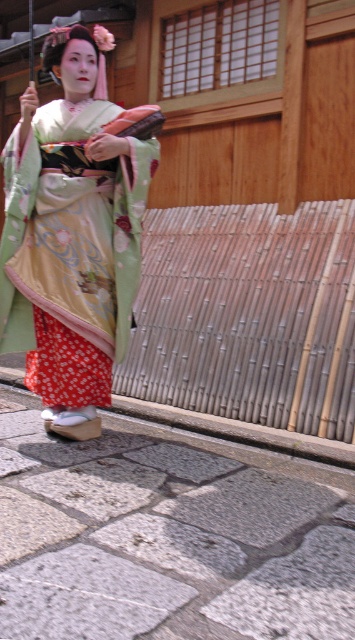
You are standing at the point marked as point (165, 540) in the image. What is the name of the object located exactly at your current position?

The gray stone pavement at lower center is located at point (165, 540).

You are standing on the gray stone pavement at lower center and want to walk towards the silky green kimono at center. Which direction should you move to get closer to the kimono?

You should move forward because the gray stone pavement at lower center is closer to the viewer than the silky green kimono at center, so moving forward will bring you closer to the kimono.

You are a delivery person carrying a box that is 3 feet wide. You need to walk from the gray stone pavement at lower center to the silky green kimono at center. Can you pass through the space between them without tilting the box?

The gray stone pavement at lower center is 33.77 inches away from the silky green kimono at center. Since 33.77 inches is approximately 2.81 feet, which is less than the box width of 3 feet, you cannot pass through the space between them without tilting the box.